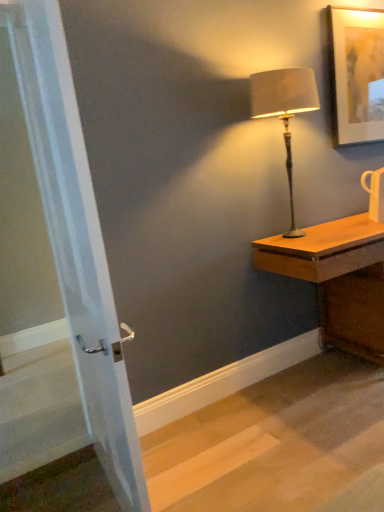
Question: Can you confirm if white glossy mug at upper right is bigger than wooden desk at right?

Choices:
 (A) no
 (B) yes

Answer: (A)

Question: Does white glossy mug at upper right have a lesser width compared to wooden desk at right?

Choices:
 (A) no
 (B) yes

Answer: (B)

Question: From a real-world perspective, is white glossy mug at upper right located beneath wooden desk at right?

Choices:
 (A) yes
 (B) no

Answer: (B)

Question: Can wooden desk at right be found inside white glossy mug at upper right?

Choices:
 (A) no
 (B) yes

Answer: (A)

Question: Considering the relative sizes of white glossy mug at upper right and wooden desk at right in the image provided, is white glossy mug at upper right shorter than wooden desk at right?

Choices:
 (A) no
 (B) yes

Answer: (B)

Question: Considering the relative positions of white glossy mug at upper right and wooden desk at right in the image provided, is white glossy mug at upper right in front of wooden desk at right?

Choices:
 (A) no
 (B) yes

Answer: (A)

Question: Is white glossy screen door at left far from white glossy mug at upper right?

Choices:
 (A) no
 (B) yes

Answer: (B)

Question: From the image's perspective, does white glossy screen door at left appear lower than white glossy mug at upper right?

Choices:
 (A) no
 (B) yes

Answer: (B)

Question: Is white glossy screen door at left not inside white glossy mug at upper right?

Choices:
 (A) no
 (B) yes

Answer: (B)

Question: Can you see white glossy screen door at left touching white glossy mug at upper right?

Choices:
 (A) no
 (B) yes

Answer: (A)

Question: Is white glossy screen door at left thinner than white glossy mug at upper right?

Choices:
 (A) no
 (B) yes

Answer: (B)

Question: Is white glossy screen door at left further to the viewer compared to white glossy mug at upper right?

Choices:
 (A) yes
 (B) no

Answer: (B)

Question: Is wooden desk at right positioned before satin beige lampshade at right?

Choices:
 (A) no
 (B) yes

Answer: (B)